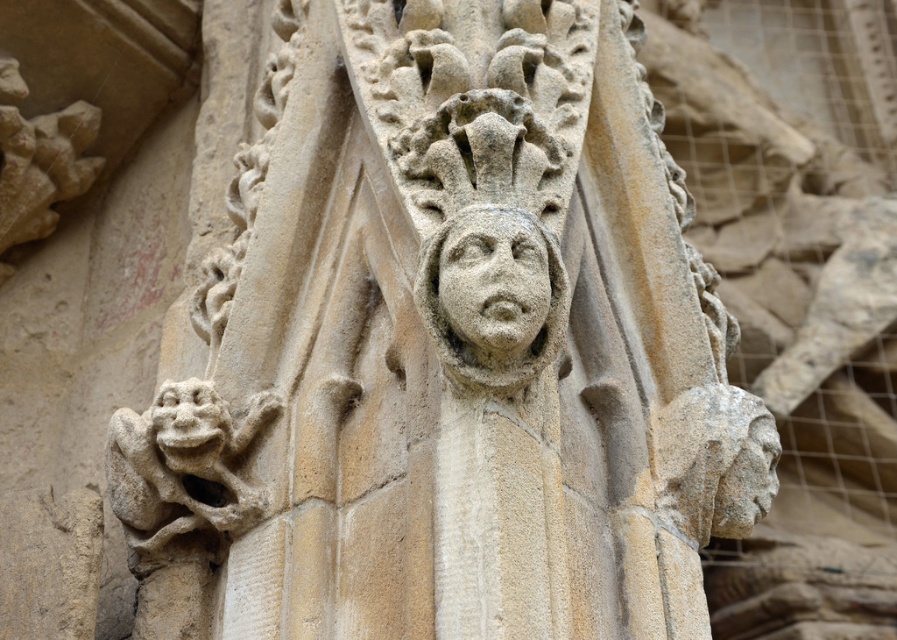
Question: Does stone textured gargoyle at lower left appear over gray stone head at center?

Choices:
 (A) yes
 (B) no

Answer: (B)

Question: Among these objects, which one is farthest from the camera?

Choices:
 (A) stone textured gargoyle at lower left
 (B) gray stone head at center
 (C) stone carved face at center

Answer: (B)

Question: Is stone textured gargoyle at lower left further to camera compared to gray stone head at center?

Choices:
 (A) yes
 (B) no

Answer: (B)

Question: Which point is farther to the camera?

Choices:
 (A) pyautogui.click(x=768, y=424)
 (B) pyautogui.click(x=179, y=456)

Answer: (A)

Question: Estimate the real-world distances between objects in this image. Which object is closer to the gray stone head at center?

Choices:
 (A) stone textured gargoyle at lower left
 (B) stone carved face at center

Answer: (B)

Question: Does stone textured gargoyle at lower left appear under gray stone head at center?

Choices:
 (A) yes
 (B) no

Answer: (A)